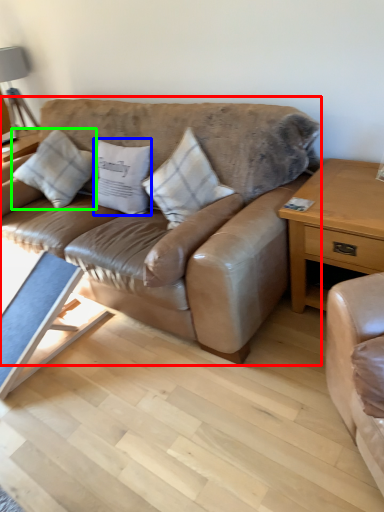
Question: Considering the real-world distances, which object is closest to studio couch (highlighted by a red box)? pillow (highlighted by a blue box) or pillow (highlighted by a green box).

Choices:
 (A) pillow
 (B) pillow

Answer: (A)